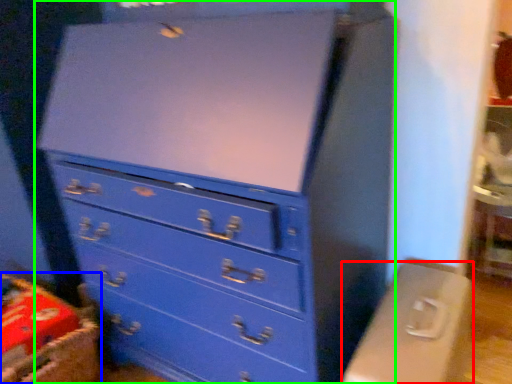
Question: Which object is positioned farthest from computer desk (highlighted by a red box)? Select from crate (highlighted by a blue box) and chest of drawers (highlighted by a green box).

Choices:
 (A) crate
 (B) chest of drawers

Answer: (A)